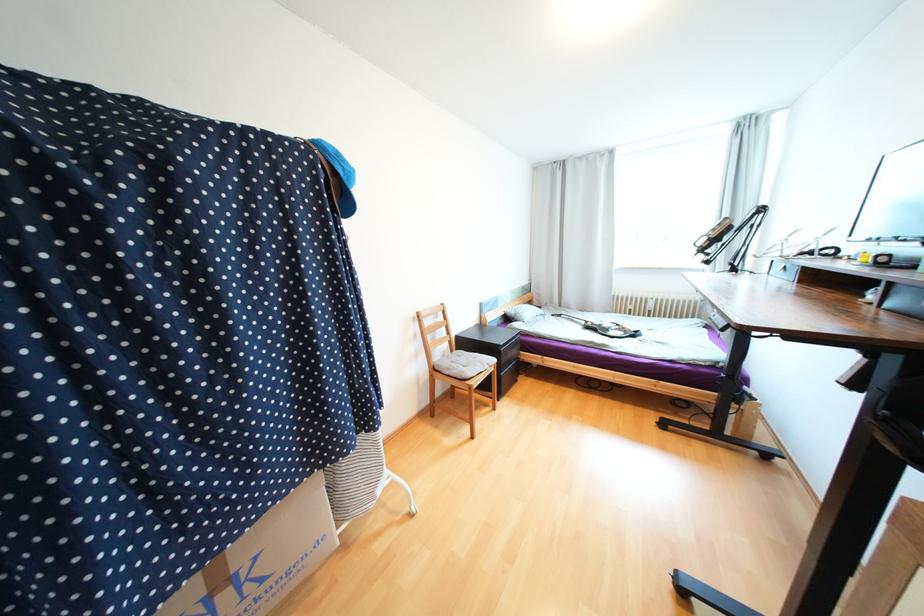
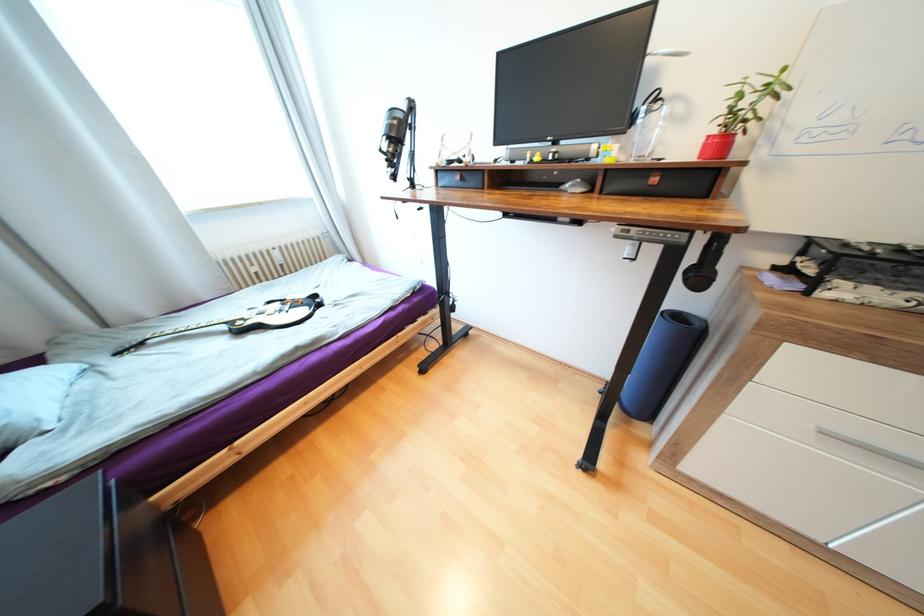
Find the pixel in the second image that matches pixel 590 323 in the first image.

(229, 328)